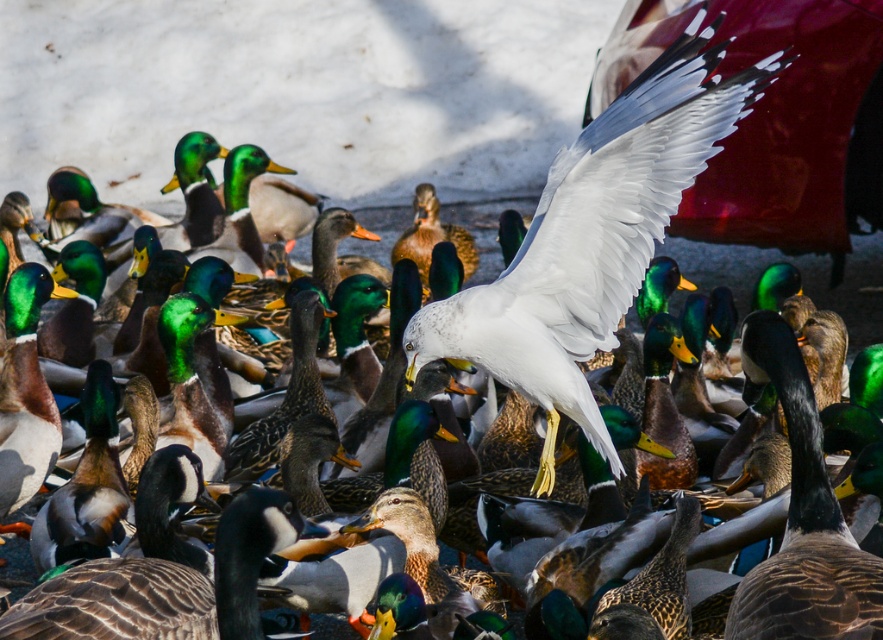
You are observing a group of birds in a park. You notice a white feathered seagull at center and a green glossy duck at center. From the perspective of someone standing in front of the birds, which bird is positioned to the right?

The white feathered seagull at center is positioned to the right of the green glossy duck at center.

You are a birdwatcher observing the scene. You notice the brown speckled goose at center and the green glossy duck at left. Which bird is positioned lower in the image?

The brown speckled goose at center is positioned lower than the green glossy duck at left.